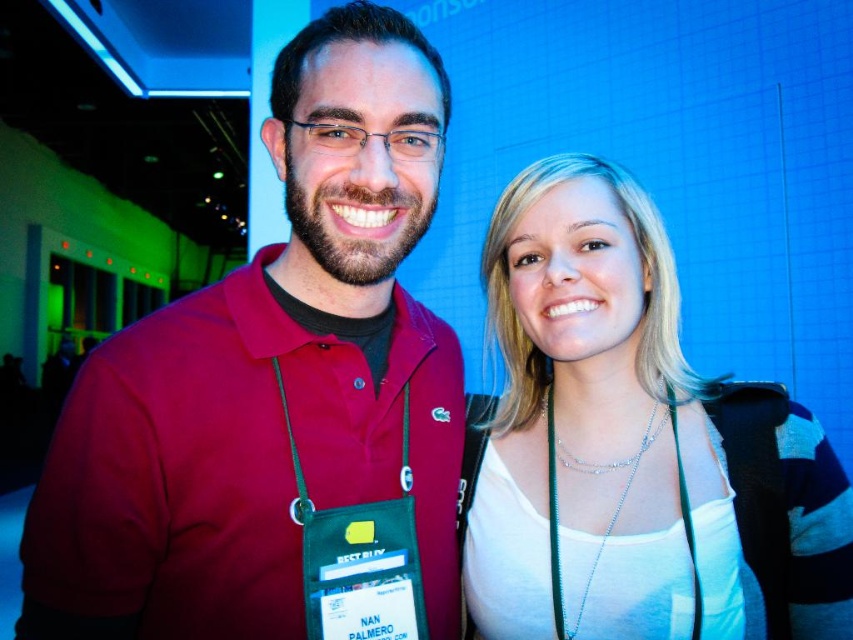
Can you confirm if matte red polo shirt at center is shorter than silver chain lanyard at center?

Incorrect, matte red polo shirt at center's height does not fall short of silver chain lanyard at center's.

The image size is (853, 640). What do you see at coordinates (270, 380) in the screenshot? I see `matte red polo shirt at center` at bounding box center [270, 380].

Who is more distant from viewer, (x=378, y=106) or (x=558, y=611)?

The point (x=558, y=611) is behind.

The height and width of the screenshot is (640, 853). In order to click on matte red polo shirt at center in this screenshot , I will do `click(270, 380)`.

Is white matte tank top at center wider than silver chain lanyard at center?

Yes, white matte tank top at center is wider than silver chain lanyard at center.

Who is more forward, [547,577] or [552,442]?

Positioned in front is point [547,577].

Find the location of a particular element. The image size is (853, 640). white matte tank top at center is located at coordinates (631, 445).

What do you see at coordinates (270, 380) in the screenshot? I see `matte red polo shirt at center` at bounding box center [270, 380].

Who is positioned more to the left, matte red polo shirt at center or white matte tank top at center?

From the viewer's perspective, matte red polo shirt at center appears more on the left side.

What do you see at coordinates (270, 380) in the screenshot? The height and width of the screenshot is (640, 853). I see `matte red polo shirt at center` at bounding box center [270, 380].

At what (x,y) coordinates should I click in order to perform the action: click on matte red polo shirt at center. Please return your answer as a coordinate pair (x, y). This screenshot has height=640, width=853. Looking at the image, I should click on (270, 380).